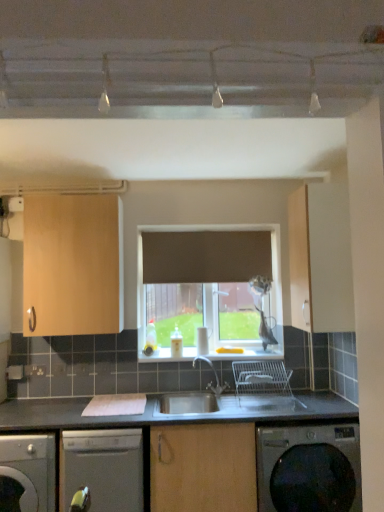
You are a GUI agent. You are given a task and a screenshot of the screen. Output one action in this format:
    pyautogui.click(x=<x>, y=<y>)
    Task: Click on the dark gray metallic washing machine at lower right
    The width and height of the screenshot is (384, 512).
    Given the screenshot: What is the action you would take?
    pyautogui.click(x=309, y=468)

What do you see at coordinates (309, 468) in the screenshot? Image resolution: width=384 pixels, height=512 pixels. I see `dark gray metallic washing machine at lower right` at bounding box center [309, 468].

This screenshot has height=512, width=384. I want to click on light wood cabinet at upper left, which ranks as the 2th cabinetry in right-to-left order, so click(73, 265).

How much space does satin silver dishwasher at lower left, acting as the first dishwasher starting from the left, occupy vertically?

The height of satin silver dishwasher at lower left, acting as the first dishwasher starting from the left, is 27.83 inches.

Describe the element at coordinates (320, 259) in the screenshot. I see `matte wood cabinet at right, the second cabinetry when ordered from left to right` at that location.

Image resolution: width=384 pixels, height=512 pixels. Identify the location of satin silver dishwasher at lower center, acting as the second dishwasher starting from the left. (103, 468).

Is white glossy window sill at center further to the viewer compared to light wood cabinet at upper left, the first cabinetry viewed from the left?

Yes, white glossy window sill at center is further from the viewer.

From the image's perspective, is white glossy window sill at center beneath light wood cabinet at upper left, which ranks as the 2th cabinetry in right-to-left order?

Correct, white glossy window sill at center appears lower than light wood cabinet at upper left, which ranks as the 2th cabinetry in right-to-left order, in the image.

Measure the distance from white glossy window sill at center to light wood cabinet at upper left, the first cabinetry viewed from the left.

The distance of white glossy window sill at center from light wood cabinet at upper left, the first cabinetry viewed from the left, is 34.26 inches.

Is white glossy window sill at center aimed at light wood cabinet at upper left, which ranks as the 2th cabinetry in right-to-left order?

No, white glossy window sill at center is not aimed at light wood cabinet at upper left, which ranks as the 2th cabinetry in right-to-left order.

Could you tell me if matte wood cabinet at right, placed as the first cabinetry when sorted from right to left, is turned towards satin silver dishwasher at lower left, acting as the first dishwasher starting from the left?

Yes, matte wood cabinet at right, placed as the first cabinetry when sorted from right to left, is aimed at satin silver dishwasher at lower left, acting as the first dishwasher starting from the left.

Considering the positions of objects matte wood cabinet at right, placed as the first cabinetry when sorted from right to left, and satin silver dishwasher at lower left, the second dishwasher in the right-to-left sequence, in the image provided, who is more to the right, matte wood cabinet at right, placed as the first cabinetry when sorted from right to left, or satin silver dishwasher at lower left, the second dishwasher in the right-to-left sequence,?

matte wood cabinet at right, placed as the first cabinetry when sorted from right to left, is more to the right.

From the image's perspective, which is above, matte wood cabinet at right, the second cabinetry when ordered from left to right, or satin silver dishwasher at lower left, acting as the first dishwasher starting from the left?

From the image's view, matte wood cabinet at right, the second cabinetry when ordered from left to right, is above.

From a real-world perspective, is matte wood cabinet at right, placed as the first cabinetry when sorted from right to left, under satin silver dishwasher at lower left, acting as the first dishwasher starting from the left?

No, from a real-world perspective, matte wood cabinet at right, placed as the first cabinetry when sorted from right to left, is not beneath satin silver dishwasher at lower left, acting as the first dishwasher starting from the left.

Looking at this image, does light wood cabinet at upper left, which ranks as the 2th cabinetry in right-to-left order, have a smaller size compared to satin silver dishwasher at lower left, the second dishwasher in the right-to-left sequence?

Yes, light wood cabinet at upper left, which ranks as the 2th cabinetry in right-to-left order, is smaller than satin silver dishwasher at lower left, the second dishwasher in the right-to-left sequence.

Is light wood cabinet at upper left, the first cabinetry viewed from the left, closer to camera compared to satin silver dishwasher at lower left, acting as the first dishwasher starting from the left?

No, the depth of light wood cabinet at upper left, the first cabinetry viewed from the left, is greater than that of satin silver dishwasher at lower left, acting as the first dishwasher starting from the left.

Looking at this image, is light wood cabinet at upper left, the first cabinetry viewed from the left, facing away from satin silver dishwasher at lower left, acting as the first dishwasher starting from the left?

No, light wood cabinet at upper left, the first cabinetry viewed from the left,'s orientation is not away from satin silver dishwasher at lower left, acting as the first dishwasher starting from the left.

From the image's perspective, is satin silver dishwasher at lower center, the 1th dishwasher viewed from the right, located above matte wood cabinet at right, placed as the first cabinetry when sorted from right to left?

Incorrect, from the image's perspective, satin silver dishwasher at lower center, the 1th dishwasher viewed from the right, is lower than matte wood cabinet at right, placed as the first cabinetry when sorted from right to left.

Considering the sizes of satin silver dishwasher at lower center, the 1th dishwasher viewed from the right, and matte wood cabinet at right, the second cabinetry when ordered from left to right, in the image, is satin silver dishwasher at lower center, the 1th dishwasher viewed from the right, wider or thinner than matte wood cabinet at right, the second cabinetry when ordered from left to right,?

Clearly, satin silver dishwasher at lower center, the 1th dishwasher viewed from the right, has more width compared to matte wood cabinet at right, the second cabinetry when ordered from left to right.

Considering the points (128, 476) and (301, 232), which point is in front, point (128, 476) or point (301, 232)?

Point (128, 476)

From a real-world perspective, which is physically above, satin silver dishwasher at lower center, the 1th dishwasher viewed from the right, or matte wood cabinet at right, placed as the first cabinetry when sorted from right to left?

In real-world perspective, matte wood cabinet at right, placed as the first cabinetry when sorted from right to left, is above.

Is satin silver dishwasher at lower center, acting as the second dishwasher starting from the left, aimed at satin silver sink at center?

No, satin silver dishwasher at lower center, acting as the second dishwasher starting from the left, is not facing towards satin silver sink at center.

Which is closer, (66, 505) or (285, 405)?

Point (66, 505) appears to be closer to the viewer than point (285, 405).

Is satin silver dishwasher at lower center, acting as the second dishwasher starting from the left, shorter than satin silver sink at center?

Incorrect, the height of satin silver dishwasher at lower center, acting as the second dishwasher starting from the left, does not fall short of that of satin silver sink at center.

From a real-world perspective, is satin silver dishwasher at lower center, the 1th dishwasher viewed from the right, on top of satin silver sink at center?

No, from a real-world perspective, satin silver dishwasher at lower center, the 1th dishwasher viewed from the right, is not over satin silver sink at center

Does dark gray metallic washing machine at lower right have a greater height compared to matte wood cabinet at right, placed as the first cabinetry when sorted from right to left?

In fact, dark gray metallic washing machine at lower right may be shorter than matte wood cabinet at right, placed as the first cabinetry when sorted from right to left.

Is dark gray metallic washing machine at lower right oriented towards matte wood cabinet at right, the second cabinetry when ordered from left to right?

No, dark gray metallic washing machine at lower right does not turn towards matte wood cabinet at right, the second cabinetry when ordered from left to right.

Is the surface of dark gray metallic washing machine at lower right in direct contact with matte wood cabinet at right, the second cabinetry when ordered from left to right?

They are not placed beside each other.

Is dark gray metallic washing machine at lower right smaller than matte wood cabinet at right, the second cabinetry when ordered from left to right?

Incorrect, dark gray metallic washing machine at lower right is not smaller in size than matte wood cabinet at right, the second cabinetry when ordered from left to right.

From the image's perspective, who appears lower, satin silver dishwasher at lower left, acting as the first dishwasher starting from the left, or light wood cabinet at upper left, which ranks as the 2th cabinetry in right-to-left order?

satin silver dishwasher at lower left, acting as the first dishwasher starting from the left, is shown below in the image.

Is satin silver dishwasher at lower left, acting as the first dishwasher starting from the left, to the left of light wood cabinet at upper left, which ranks as the 2th cabinetry in right-to-left order, from the viewer's perspective?

Yes.

Measure the distance between satin silver dishwasher at lower left, the second dishwasher in the right-to-left sequence, and light wood cabinet at upper left, the first cabinetry viewed from the left.

satin silver dishwasher at lower left, the second dishwasher in the right-to-left sequence, is 35.93 inches away from light wood cabinet at upper left, the first cabinetry viewed from the left.

Can you tell me how much satin silver dishwasher at lower left, the second dishwasher in the right-to-left sequence, and light wood cabinet at upper left, the first cabinetry viewed from the left, differ in facing direction?

7.33e-05 degrees separate the facing orientations of satin silver dishwasher at lower left, the second dishwasher in the right-to-left sequence, and light wood cabinet at upper left, the first cabinetry viewed from the left.

The height and width of the screenshot is (512, 384). What are the coordinates of `window sill below the light wood cabinet at upper left, the first cabinetry viewed from the left (from the image's perspective)` in the screenshot? It's located at pos(249,353).

This screenshot has width=384, height=512. I want to click on cabinetry that is the 1st one when counting backward from the satin silver dishwasher at lower left, the second dishwasher in the right-to-left sequence, so click(320, 259).

Based on the photo, when comparing their distances from white glossy window sill at center, does light wood cabinet at upper left, the first cabinetry viewed from the left, or dark gray metallic washing machine at lower right seem further?

light wood cabinet at upper left, the first cabinetry viewed from the left, is positioned further to the anchor white glossy window sill at center.

When comparing their distances from satin silver dishwasher at lower left, the second dishwasher in the right-to-left sequence, does white glossy window sill at center or satin silver dishwasher at lower center, acting as the second dishwasher starting from the left, seem further?

white glossy window sill at center.

Which object lies further to the anchor point light wood cabinet at upper left, the first cabinetry viewed from the left, matte wood cabinet at right, the second cabinetry when ordered from left to right, or satin silver sink at center?

The object further to light wood cabinet at upper left, the first cabinetry viewed from the left, is matte wood cabinet at right, the second cabinetry when ordered from left to right.

Which object lies nearer to the anchor point satin silver dishwasher at lower left, the second dishwasher in the right-to-left sequence, satin silver dishwasher at lower center, the 1th dishwasher viewed from the right, or dark gray metallic washing machine at lower right?

The object closer to satin silver dishwasher at lower left, the second dishwasher in the right-to-left sequence, is satin silver dishwasher at lower center, the 1th dishwasher viewed from the right.

Estimate the real-world distances between objects in this image. Which object is closer to dark gray metallic washing machine at lower right, satin silver dishwasher at lower center, acting as the second dishwasher starting from the left, or satin silver dishwasher at lower left, the second dishwasher in the right-to-left sequence?

satin silver dishwasher at lower center, acting as the second dishwasher starting from the left, lies closer to dark gray metallic washing machine at lower right than the other object.

From the image, which object appears to be farther from satin silver sink at center, white glossy window sill at center or light wood cabinet at upper left, which ranks as the 2th cabinetry in right-to-left order?

Based on the image, light wood cabinet at upper left, which ranks as the 2th cabinetry in right-to-left order, appears to be further to satin silver sink at center.

From the image, which object appears to be farther from dark gray metallic washing machine at lower right, white glossy window sill at center or satin silver dishwasher at lower left, the second dishwasher in the right-to-left sequence?

Based on the image, satin silver dishwasher at lower left, the second dishwasher in the right-to-left sequence, appears to be further to dark gray metallic washing machine at lower right.

Looking at this image, considering their positions, is satin silver sink at center positioned further to matte wood cabinet at right, placed as the first cabinetry when sorted from right to left, than white glossy window sill at center?

white glossy window sill at center is further to matte wood cabinet at right, placed as the first cabinetry when sorted from right to left.

Identify the location of sink situated between light wood cabinet at upper left, the first cabinetry viewed from the left, and dark gray metallic washing machine at lower right from left to right. (237, 394).

This screenshot has width=384, height=512. I want to click on sink between light wood cabinet at upper left, the first cabinetry viewed from the left, and satin silver dishwasher at lower center, acting as the second dishwasher starting from the left, in the vertical direction, so click(237, 394).

Find the location of `window sill situated between light wood cabinet at upper left, the first cabinetry viewed from the left, and satin silver sink at center from left to right`. window sill situated between light wood cabinet at upper left, the first cabinetry viewed from the left, and satin silver sink at center from left to right is located at coordinates (249, 353).

Where is `window sill between matte wood cabinet at right, placed as the first cabinetry when sorted from right to left, and dark gray metallic washing machine at lower right in the up-down direction`? The width and height of the screenshot is (384, 512). window sill between matte wood cabinet at right, placed as the first cabinetry when sorted from right to left, and dark gray metallic washing machine at lower right in the up-down direction is located at coordinates (249, 353).